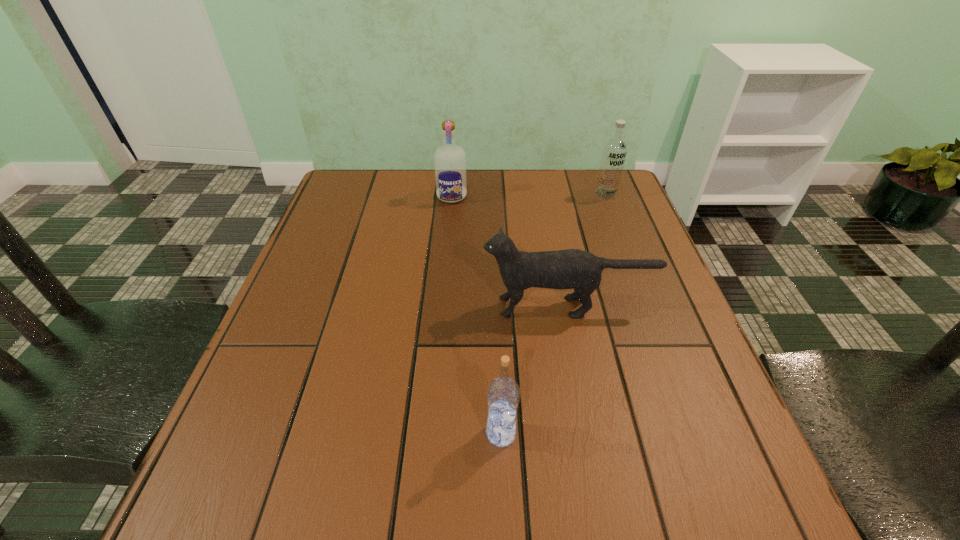
I want to click on object that is the second nearest to the third farthest object, so click(449, 159).

Locate an element on the screen. Image resolution: width=960 pixels, height=540 pixels. vodka identified as the closest to the leftmost vodka is located at coordinates (614, 151).

Point out which vodka is positioned as the third nearest to the second nearest object. Please provide its 2D coordinates. Your answer should be formatted as a tuple, i.e. [(x, y)], where the tuple contains the x and y coordinates of a point satisfying the conditions above.

[(614, 151)]

I want to click on vacant region that satisfies the following two spatial constraints: 1. on the label of the leftmost vodka; 2. on the right side of the second vodka from left to right, so click(432, 434).

Identify the location of free space that satisfies the following two spatial constraints: 1. on the label of the nearest vodka; 2. on the left side of the leftmost object. (432, 434).

Identify the location of free space in the image that satisfies the following two spatial constraints: 1. on the front-facing side of the second nearest object; 2. on the front side of the nearest vodka. This screenshot has width=960, height=540. (592, 434).